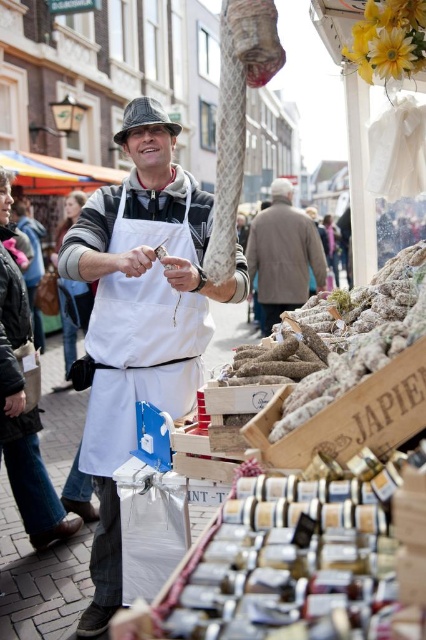
Can you confirm if white apron at center is wider than white canvas apron at center?

Indeed, white apron at center has a greater width compared to white canvas apron at center.

Does white apron at center have a lesser height compared to white canvas apron at center?

Incorrect, white apron at center's height does not fall short of white canvas apron at center's.

Measure the distance between white apron at center and camera.

A distance of 11.68 feet exists between white apron at center and camera.

Identify the location of white apron at center. (140, 316).

Is white apron at center to the right of brown woolen coat at center from the viewer's perspective?

Incorrect, white apron at center is not on the right side of brown woolen coat at center.

Locate an element on the screen. white apron at center is located at coordinates (140, 316).

Is white canvas apron at center to the left of brown woolen coat at center from the viewer's perspective?

Correct, you'll find white canvas apron at center to the left of brown woolen coat at center.

Is white canvas apron at center taller than brown woolen coat at center?

Incorrect, white canvas apron at center's height is not larger of brown woolen coat at center's.

Is point (108, 356) positioned before point (275, 243)?

Yes, point (108, 356) is closer to viewer.

Image resolution: width=426 pixels, height=640 pixels. What are the coordinates of `white canvas apron at center` in the screenshot? It's located at (140, 358).